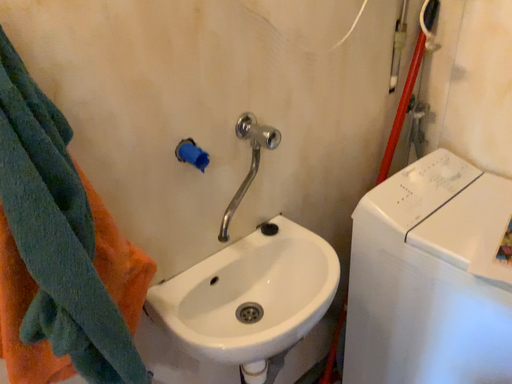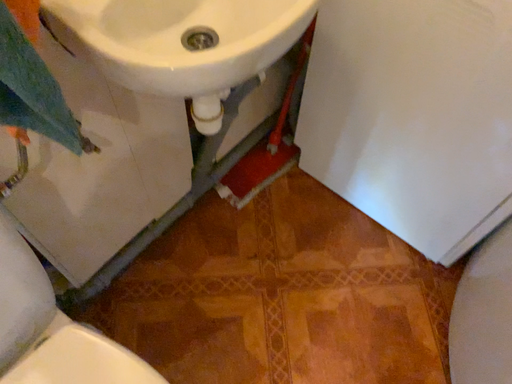
Question: How did the camera likely rotate when shooting the video?

Choices:
 (A) rotated downward
 (B) rotated upward

Answer: (A)